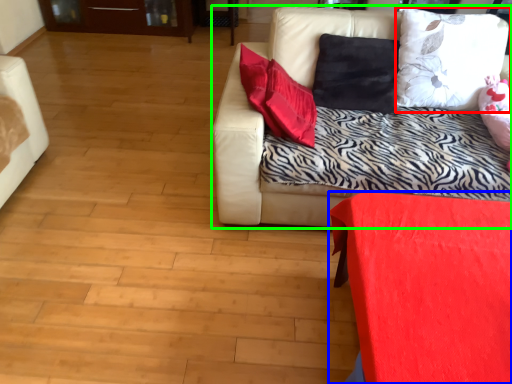
Question: Which is farther away from pillow (highlighted by a red box)? furniture (highlighted by a blue box) or studio couch (highlighted by a green box)?

Choices:
 (A) furniture
 (B) studio couch

Answer: (A)